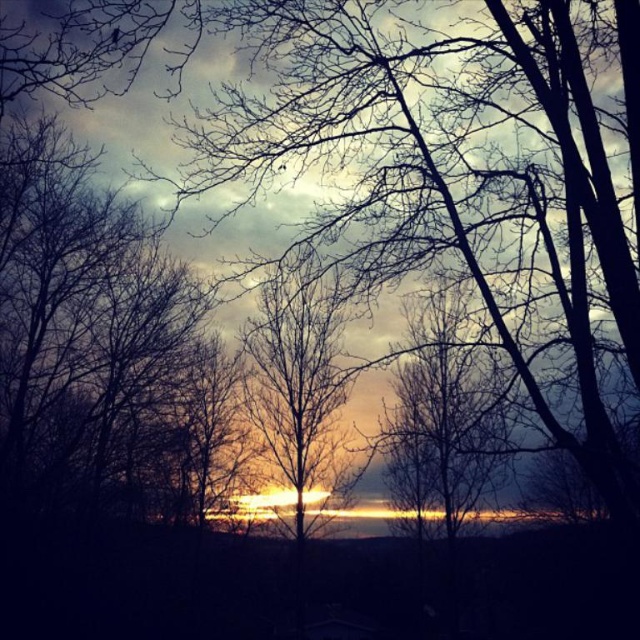
You are an astronomer observing the sunset scene. You notice two points in the sky at coordinates point (422, 465) and point (332, 428). Based on their positions, which point is closer to the horizon?

Point (422, 465) is in front of point (332, 428), so it is closer to the horizon.

You are a painter standing at the edge of a field, and you want to paint the two silhouettes of the trees in the sunset scene. The first silhouette is labeled as the silhouette bare tree at center, and the second is the silhouetted bare tree at center. Which tree is closer to you?

Both the silhouette bare tree at center and the silhouetted bare tree at center are actually the same tree. The description mentions they are 2.42 meters apart, but since they are the same object, there is no difference in distance. Please check the labels again for accuracy.

You are an artist trying to sketch the sunset scene. You notice two silhouetted trees at the center. Which one is narrower when comparing the silhouette bare tree at center and the silhouetted bare tree at center?

The silhouette bare tree at center is narrower than the silhouetted bare tree at center because its width is less than the other.